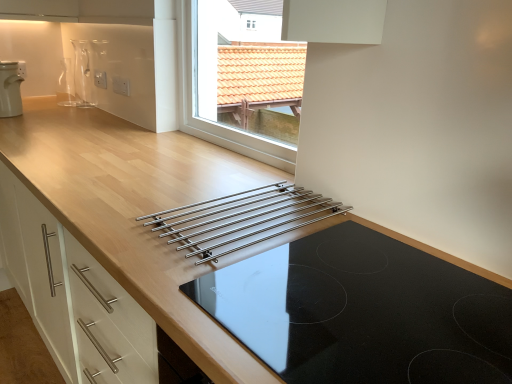
Question: Is stainless steel rack at center in front of transparent glass vase at upper left?

Choices:
 (A) no
 (B) yes

Answer: (B)

Question: From the image's perspective, is stainless steel rack at center on transparent glass vase at upper left?

Choices:
 (A) yes
 (B) no

Answer: (B)

Question: Could you tell me if stainless steel rack at center is turned towards transparent glass vase at upper left?

Choices:
 (A) yes
 (B) no

Answer: (B)

Question: Is stainless steel rack at center behind transparent glass vase at upper left?

Choices:
 (A) no
 (B) yes

Answer: (A)

Question: From a real-world perspective, is stainless steel rack at center physically above transparent glass vase at upper left?

Choices:
 (A) yes
 (B) no

Answer: (B)

Question: In terms of height, does black glass cooktop at center look taller or shorter compared to white plastic kettle at upper left?

Choices:
 (A) short
 (B) tall

Answer: (A)

Question: Is black glass cooktop at center in front of or behind white plastic kettle at upper left in the image?

Choices:
 (A) front
 (B) behind

Answer: (A)

Question: In terms of width, does black glass cooktop at center look wider or thinner when compared to white plastic kettle at upper left?

Choices:
 (A) wide
 (B) thin

Answer: (A)

Question: From a real-world perspective, relative to white plastic kettle at upper left, is black glass cooktop at center vertically above or below?

Choices:
 (A) above
 (B) below

Answer: (B)

Question: Would you say transparent glass vase at upper left is inside or outside white plastic kettle at upper left?

Choices:
 (A) inside
 (B) outside

Answer: (B)

Question: From a real-world perspective, relative to white plastic kettle at upper left, is transparent glass vase at upper left vertically above or below?

Choices:
 (A) above
 (B) below

Answer: (A)

Question: In terms of height, does transparent glass vase at upper left look taller or shorter compared to white plastic kettle at upper left?

Choices:
 (A) tall
 (B) short

Answer: (A)

Question: From the image's perspective, is transparent glass vase at upper left located above or below white plastic kettle at upper left?

Choices:
 (A) below
 (B) above

Answer: (B)

Question: Considering the positions of point (12, 104) and point (226, 241), is point (12, 104) closer or farther from the camera than point (226, 241)?

Choices:
 (A) farther
 (B) closer

Answer: (A)

Question: From the image's perspective, is white plastic kettle at upper left above or below stainless steel rack at center?

Choices:
 (A) below
 (B) above

Answer: (B)